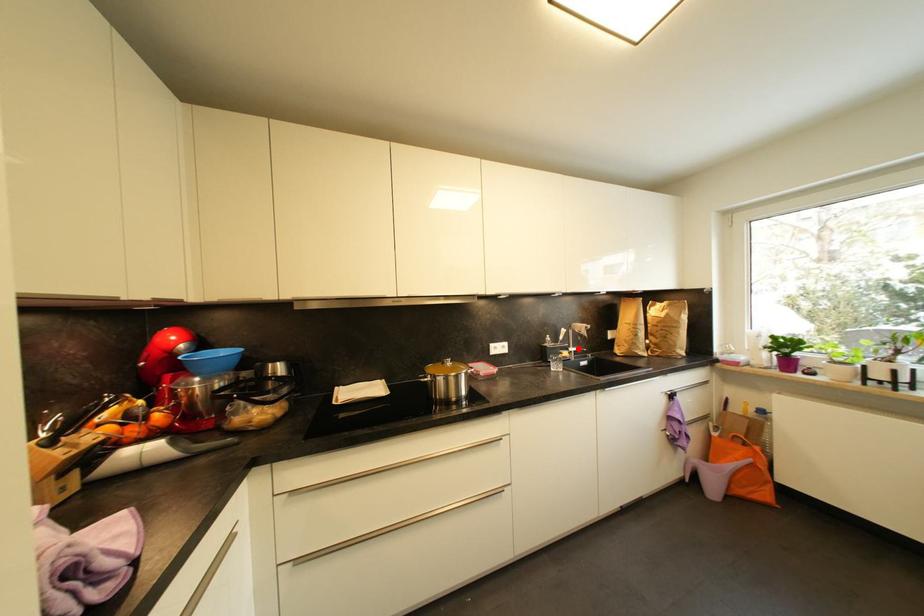
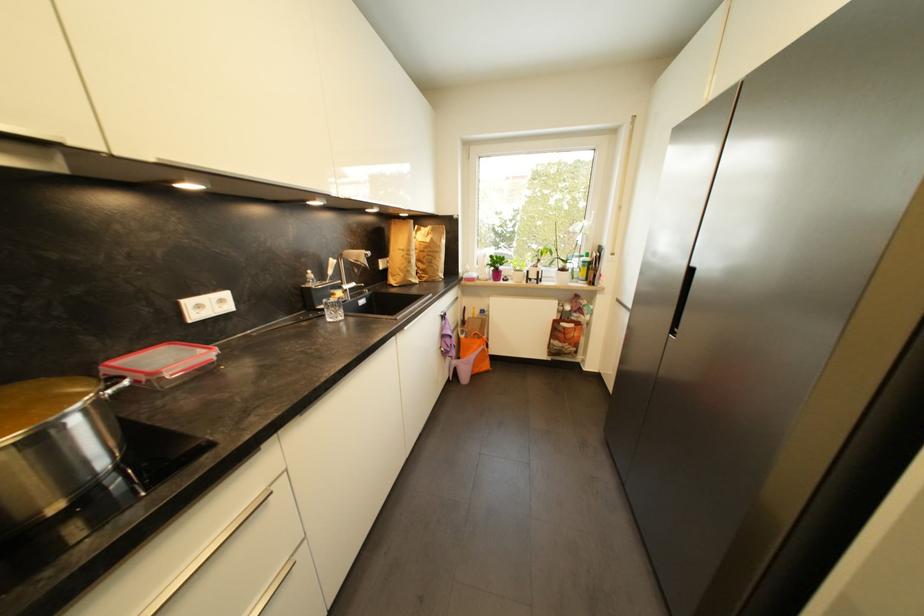
Question: I am providing you with two images of the same scene from different viewpoints. In image1, a red point is highlighted. Considering the same 3D point in image2, which of the following is correct?

Choices:
 (A) It is closer
 (B) It is farther

Answer: (A)